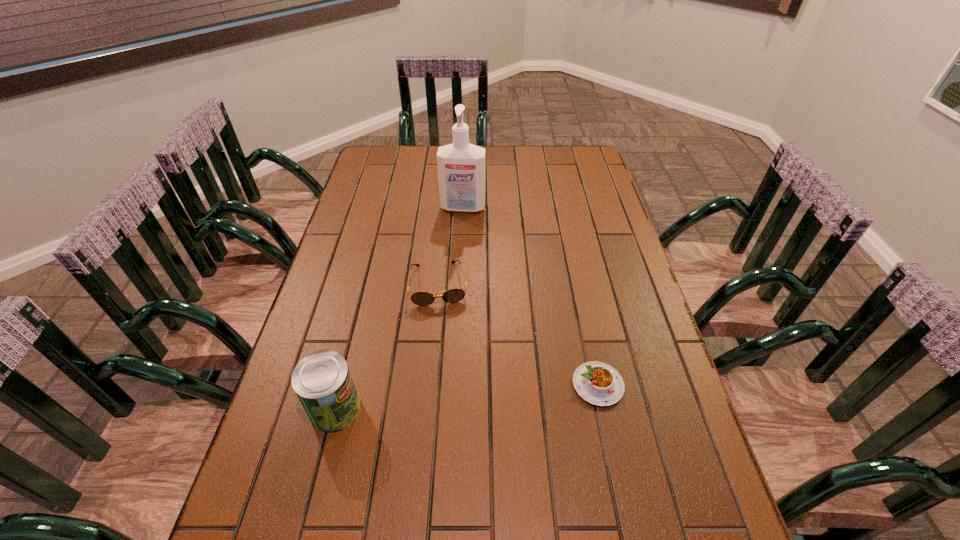
This screenshot has width=960, height=540. What are the coordinates of `can` in the screenshot? It's located at (322, 381).

Where is `the second tallest object`? the second tallest object is located at coordinates [x=322, y=381].

Where is `pudding`? The height and width of the screenshot is (540, 960). pudding is located at coordinates (597, 383).

Locate an element on the screen. the shortest object is located at coordinates (597, 383).

I want to click on the farthest object, so click(x=461, y=166).

Identify the location of the tallest object. The height and width of the screenshot is (540, 960). (461, 166).

Locate an element on the screen. The image size is (960, 540). sunglasses is located at coordinates (421, 298).

This screenshot has height=540, width=960. I want to click on the third tallest object, so click(x=421, y=298).

Identify the location of free space located 0.380m on the right of the leftmost object. Image resolution: width=960 pixels, height=540 pixels. (527, 408).

Where is `vacant space situated on the left of the rightmost object`? The height and width of the screenshot is (540, 960). vacant space situated on the left of the rightmost object is located at coordinates (446, 385).